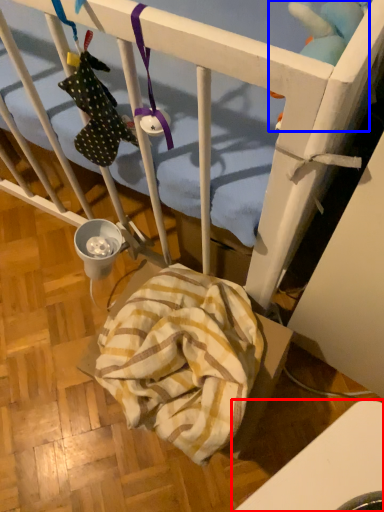
Question: Which object is further to the camera taking this photo, furniture (highlighted by a red box) or toy (highlighted by a blue box)?

Choices:
 (A) furniture
 (B) toy

Answer: (B)